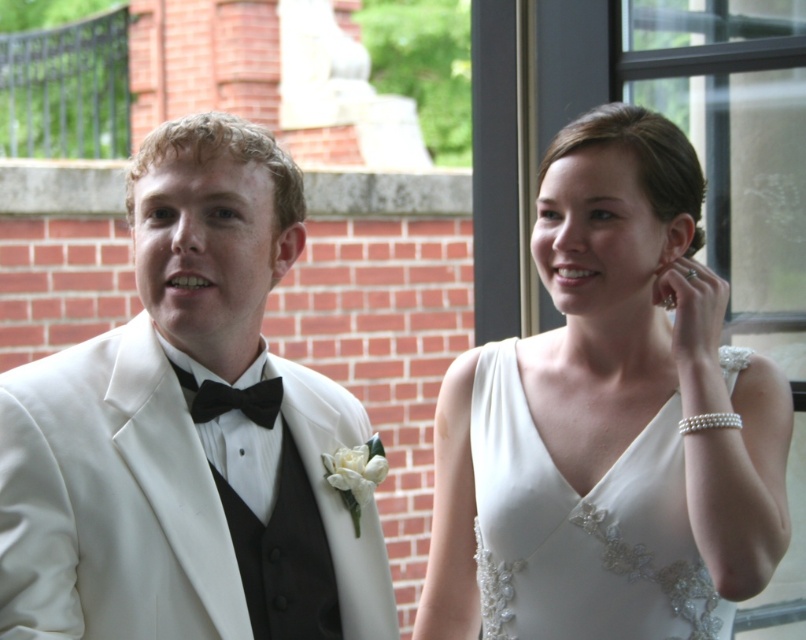
You are a photographer at a wedding, and you need to capture a closeup shot of both the white satin tuxedo at left and the white satin dress at upper right. The camera you are using has a maximum focus range of 1 meter. Can you fit both subjects within the camera focus range?

The distance between the white satin tuxedo at left and the white satin dress at upper right is 75.83 centimeters, which is less than the camera focus range of 1 meter. Therefore, both subjects can be captured within the focus range.

You are a photographer at a wedding and need to adjust the lighting to ensure both the white satin tuxedo at left and the white satin dress at center are visible. Since they are both white, how can you tell which one is closer to the camera?

The white satin tuxedo at left is in front of the white satin dress at center, so it appears closer to the camera.

You are a photographer at the wedding and need to position two lights. One light must be placed at point [663,593] and the other at point [256,396]. From the camera angle, which light will appear closer to the front of the scene?

Point [256,396] will appear closer to the front of the scene because it is in front of point [663,593].